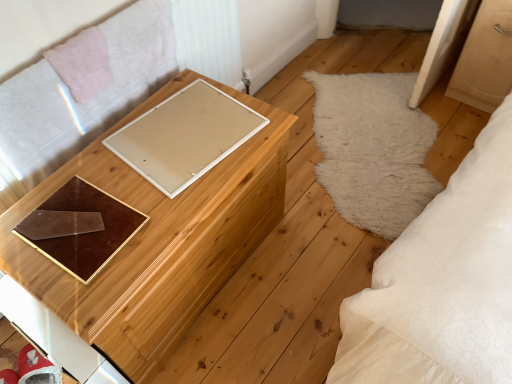
The width and height of the screenshot is (512, 384). Find the location of `blank space situated above wooden chest at center (from a real-world perspective)`. blank space situated above wooden chest at center (from a real-world perspective) is located at coordinates (139, 169).